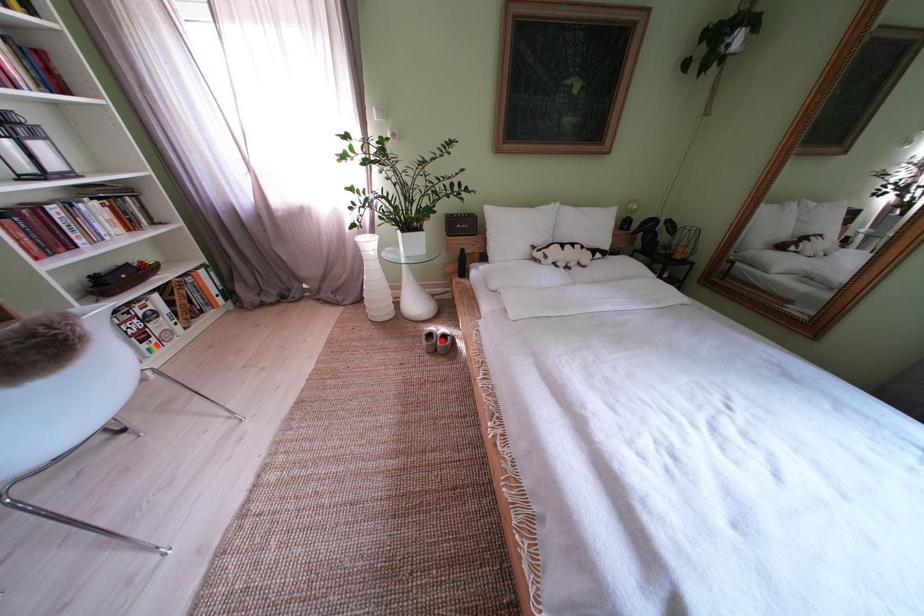
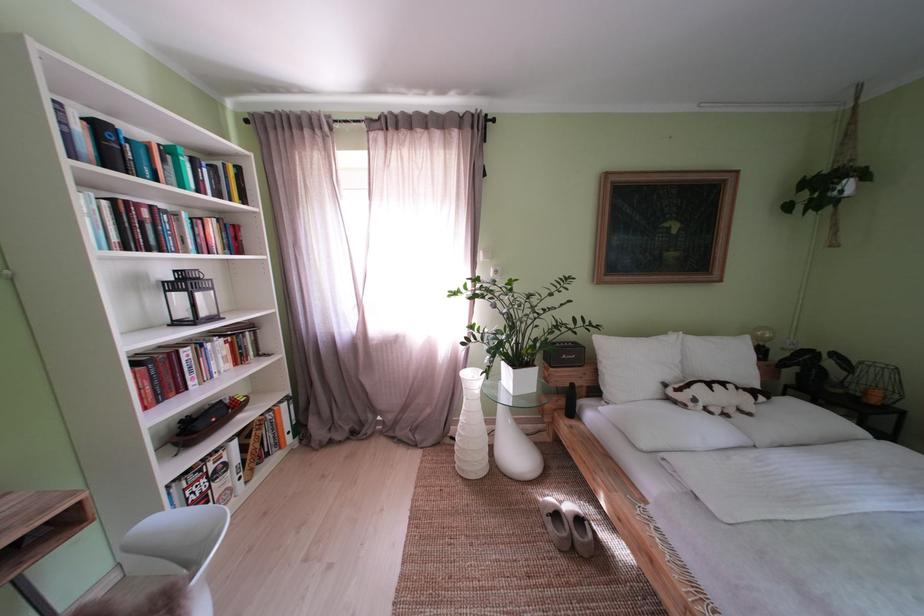
The point at the highlighted location is marked in the first image. Where is the corresponding point in the second image?

(567, 521)